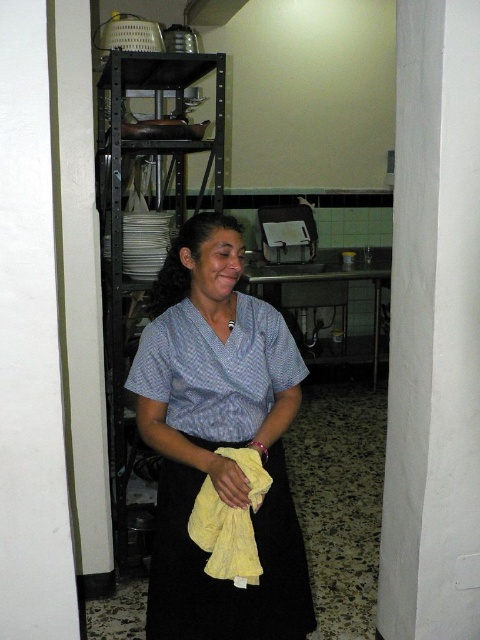
Question: Which of the following is the farthest from the observer?

Choices:
 (A) (165, 620)
 (B) (152, 353)

Answer: (A)

Question: Does yellow cotton towel at center come behind yellow soft cloth at center?

Choices:
 (A) no
 (B) yes

Answer: (A)

Question: Is yellow cotton towel at center closer to the viewer compared to yellow soft cloth at center?

Choices:
 (A) yes
 (B) no

Answer: (A)

Question: Which point appears farthest from the camera in this image?

Choices:
 (A) (223, 356)
 (B) (240, 406)

Answer: (A)

Question: Does yellow cotton towel at center have a greater width compared to metallic gray exhaust hood at upper center?

Choices:
 (A) no
 (B) yes

Answer: (B)

Question: Which object is positioned closest to the yellow cotton towel at center?

Choices:
 (A) blue printed shirt at center
 (B) yellow soft cloth at center

Answer: (A)